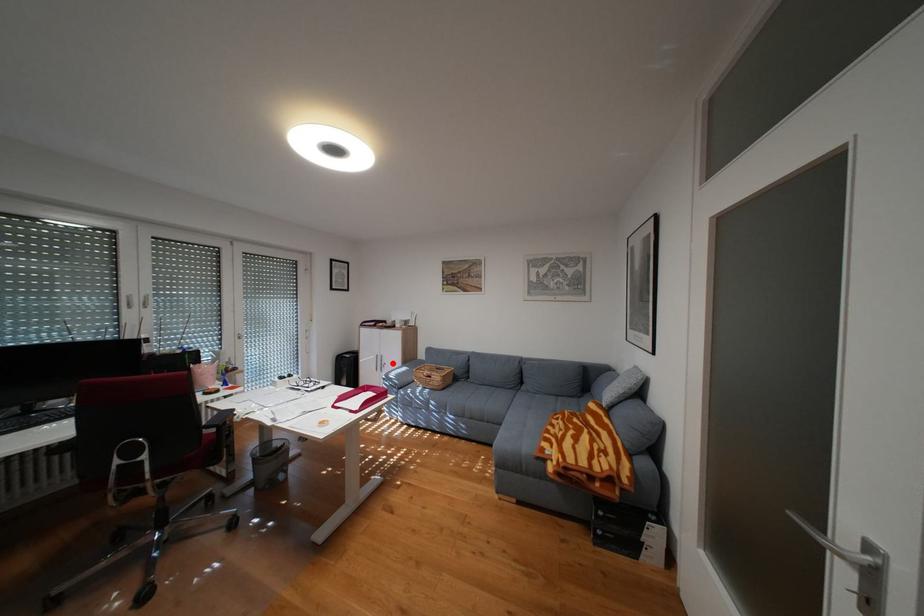
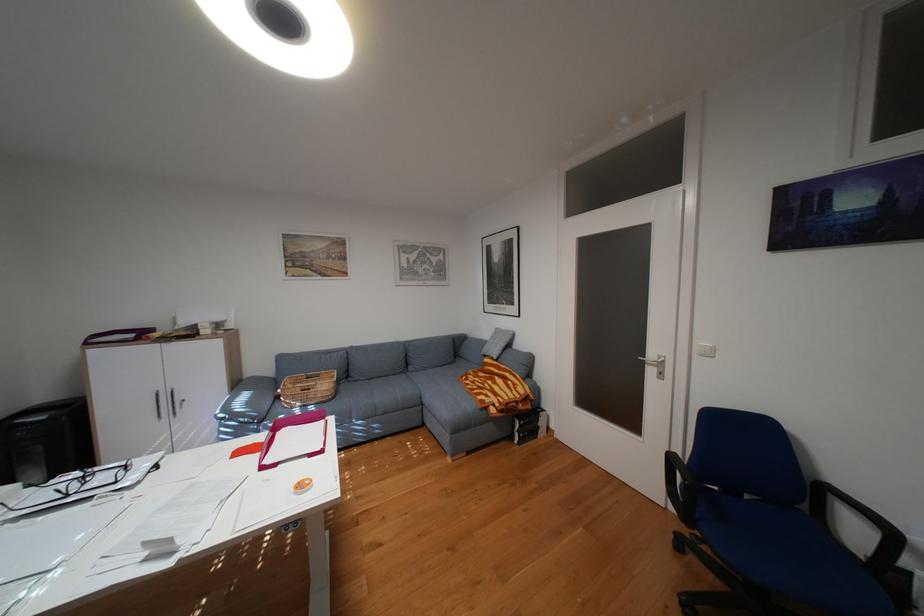
Find the pixel in the second image that matches the highlighted location in the first image.

(180, 403)